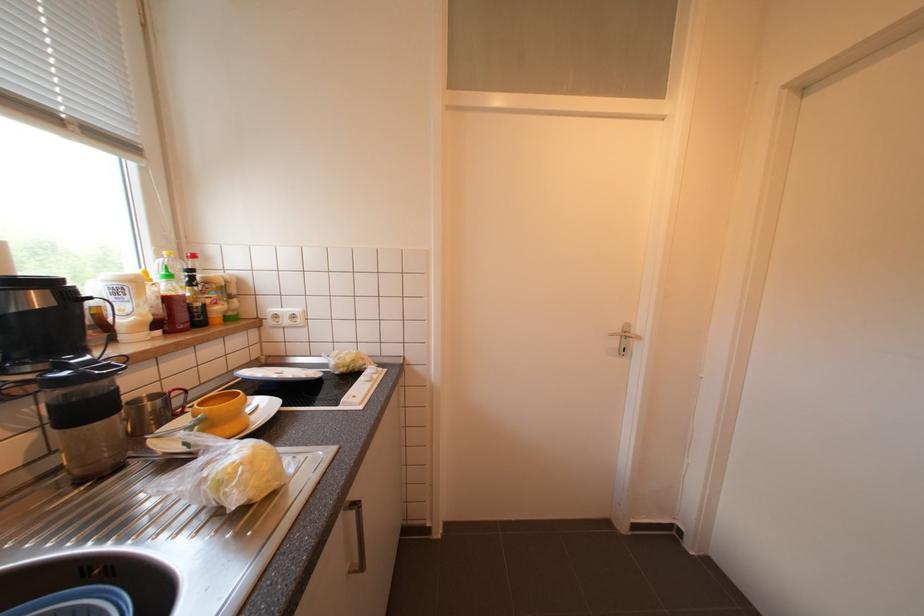
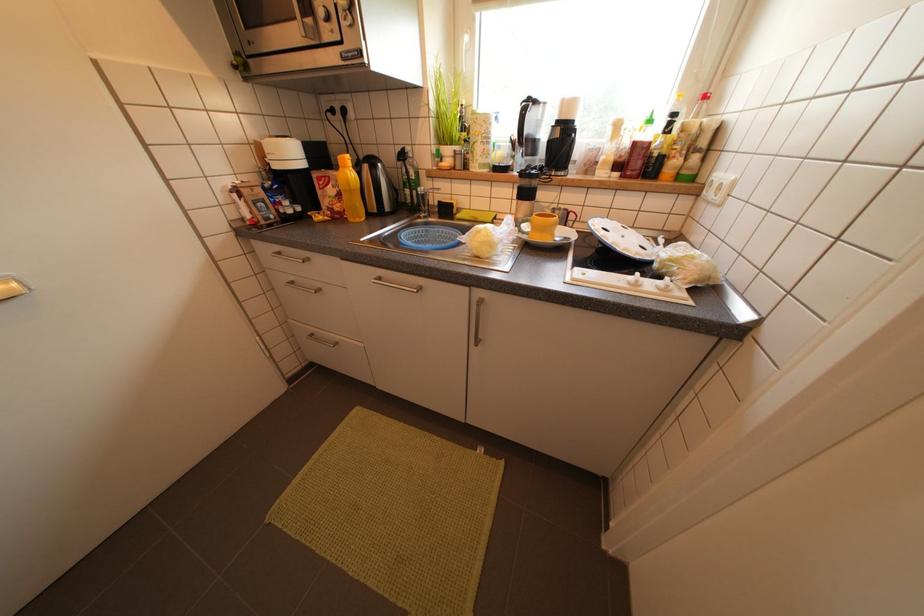
How did the camera likely rotate?

The camera's rotation is toward left-down.